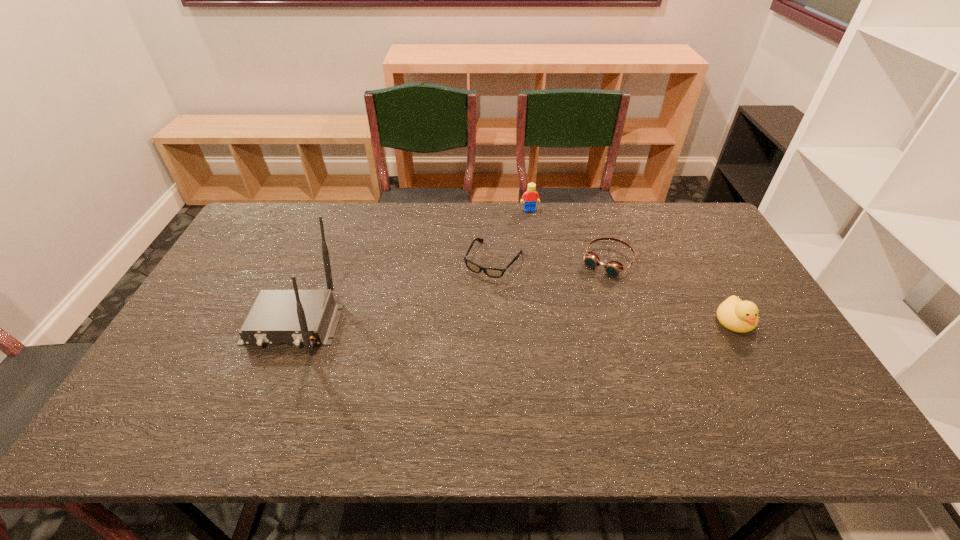
The height and width of the screenshot is (540, 960). Identify the location of vacant space on the desktop that is between the leftmost object and the duckling and is positioned on the front-facing side of the spectacles. (455, 323).

Where is `vacant spot on the desktop that is between the tallest object and the rightmost object and is positioned on the face of the farthest object`? vacant spot on the desktop that is between the tallest object and the rightmost object and is positioned on the face of the farthest object is located at coordinates (558, 322).

In order to click on free space on the desktop that is between the tallest object and the third shortest object and is positioned through the lenses of the fourth object from left to right in this screenshot , I will do `click(565, 322)`.